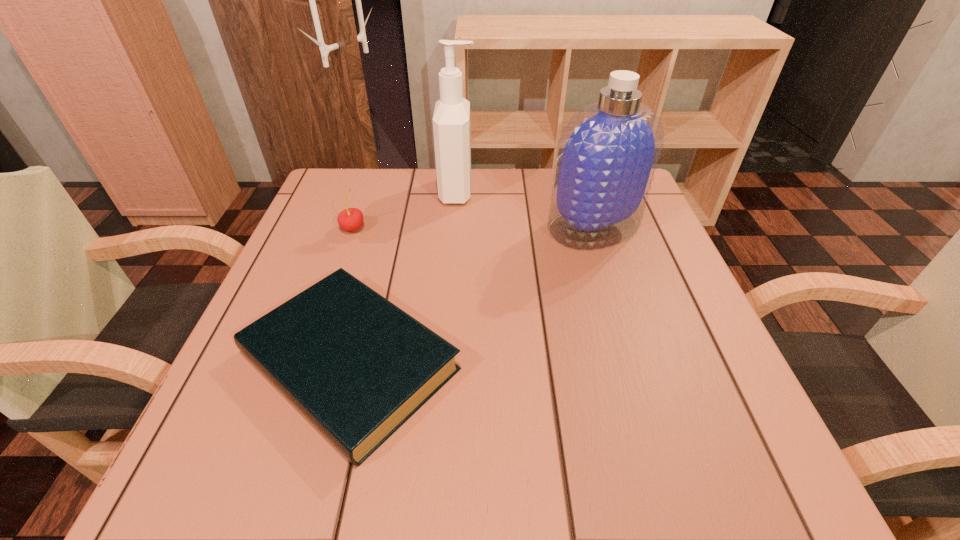
Locate an element on the screen. object that can be found as the second closest to the left cleansing agent is located at coordinates (350, 219).

The image size is (960, 540). In order to click on free space that satisfies the following two spatial constraints: 1. on the back side of the rightmost object; 2. on the front label of the left cleansing agent in this screenshot , I will do `click(582, 191)`.

Locate an element on the screen. free space that satisfies the following two spatial constraints: 1. on the front label of the rightmost object; 2. on the left side of the left cleansing agent is located at coordinates (455, 227).

Locate an element on the screen. This screenshot has height=540, width=960. free location that satisfies the following two spatial constraints: 1. on the back side of the rightmost object; 2. on the right side of the nearest object is located at coordinates (385, 227).

Locate an element on the screen. This screenshot has width=960, height=540. free space that satisfies the following two spatial constraints: 1. on the front label of the right cleansing agent; 2. on the left side of the left cleansing agent is located at coordinates (455, 227).

I want to click on free space that satisfies the following two spatial constraints: 1. on the back side of the right cleansing agent; 2. on the front label of the left cleansing agent, so click(x=582, y=191).

In order to click on vacant space that satisfies the following two spatial constraints: 1. on the front label of the left cleansing agent; 2. on the front side of the nearest object in this screenshot , I will do pos(445,361).